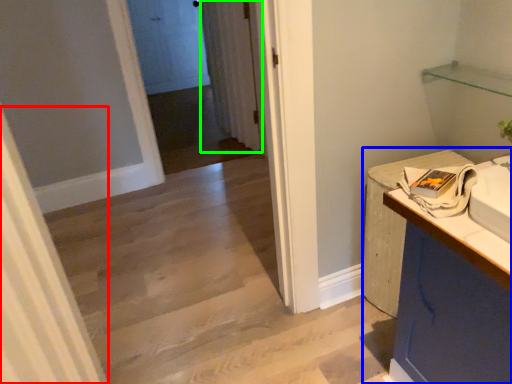
Question: Which is nearer to the curtain (highlighted by a red box)? counter (highlighted by a blue box) or curtain (highlighted by a green box).

Choices:
 (A) counter
 (B) curtain

Answer: (A)